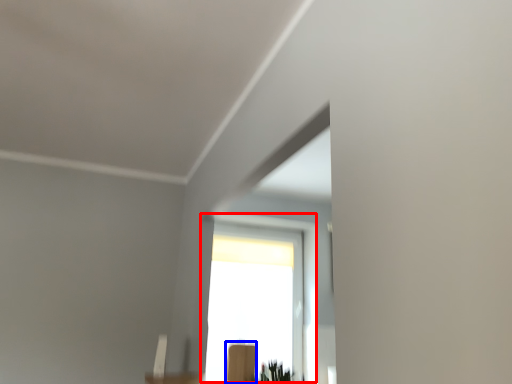
Question: Which point is further to the camera, window (highlighted by a red box) or furniture (highlighted by a blue box)?

Choices:
 (A) window
 (B) furniture

Answer: (A)